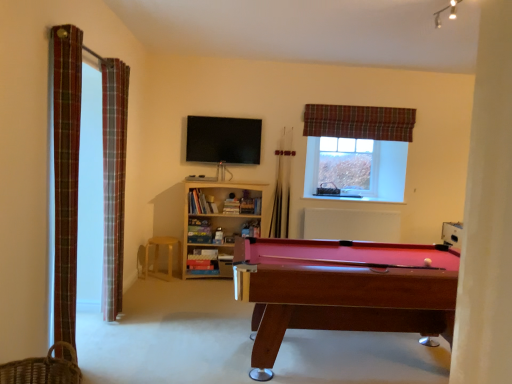
Where is `unoccupied region to the right of plaid fabric curtain at left, which is the 2th curtain from left to right`? Image resolution: width=512 pixels, height=384 pixels. unoccupied region to the right of plaid fabric curtain at left, which is the 2th curtain from left to right is located at coordinates (98, 362).